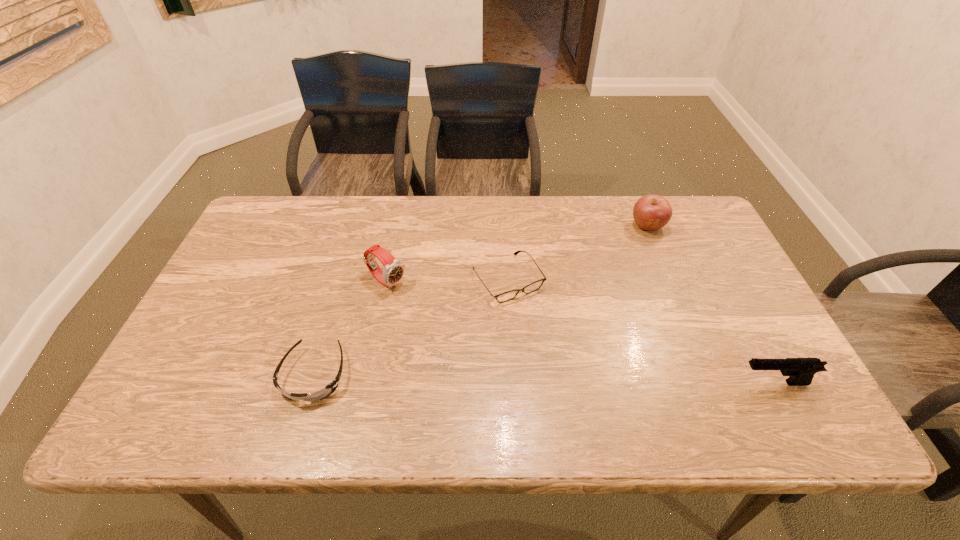
Locate an element on the screen. This screenshot has height=540, width=960. free space between the pistol and the sunglasses is located at coordinates pyautogui.click(x=543, y=379).

Find the location of a particular element. vacant point located between the tallest object and the sunglasses is located at coordinates (350, 328).

The width and height of the screenshot is (960, 540). I want to click on vacant area that lies between the watch and the pistol, so click(x=580, y=332).

I want to click on free spot between the pistol and the apple, so point(710,305).

Find the location of `unoccupied position between the third object from left to right and the watch`. unoccupied position between the third object from left to right and the watch is located at coordinates (447, 280).

Where is `vacant area that lies between the sunglasses and the farthest object`? The height and width of the screenshot is (540, 960). vacant area that lies between the sunglasses and the farthest object is located at coordinates (481, 301).

At what (x,y) coordinates should I click in order to perform the action: click on empty space that is in between the farthest object and the pistol. Please return your answer as a coordinate pair (x, y). The image size is (960, 540). Looking at the image, I should click on (710, 305).

In order to click on empty space that is in between the spectacles and the watch in this screenshot , I will do `click(447, 280)`.

Where is `free space between the pistol and the apple`? free space between the pistol and the apple is located at coordinates (710, 305).

Locate which object is the closest to the pistol. Please provide its 2D coordinates. Your answer should be formatted as a tuple, i.e. [(x, y)], where the tuple contains the x and y coordinates of a point satisfying the conditions above.

[(509, 295)]